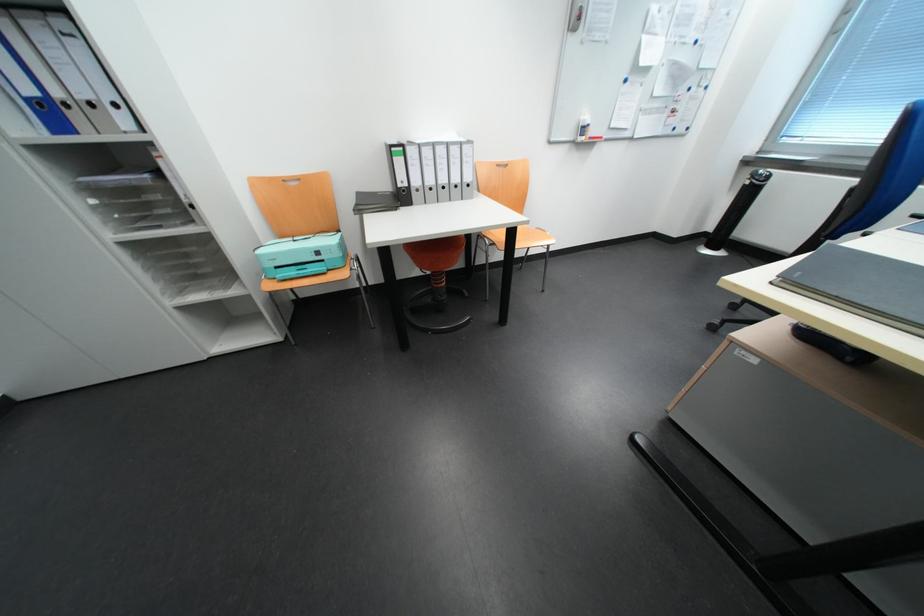
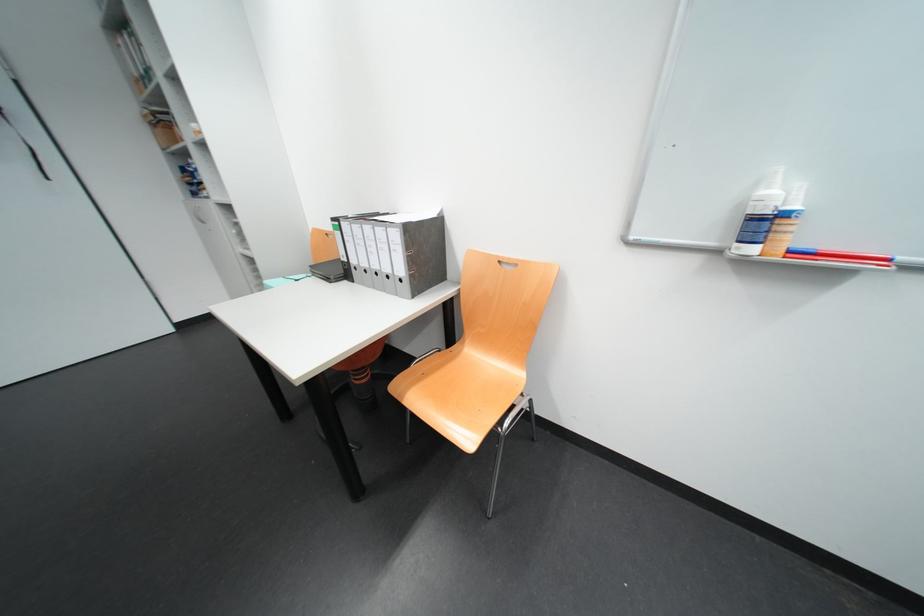
In the second image, find the point that corresponds to point 418,185 in the first image.

(358, 262)